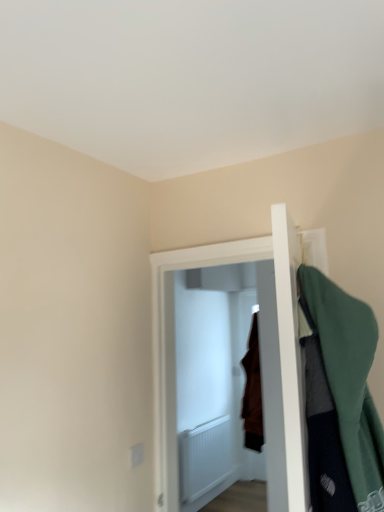
What do you see at coordinates (262, 356) in the screenshot? Image resolution: width=384 pixels, height=512 pixels. I see `white wooden door at center` at bounding box center [262, 356].

At what (x,y) coordinates should I click in order to perform the action: click on white wooden door at center. Please return your answer as a coordinate pair (x, y). Looking at the image, I should click on click(x=262, y=356).

This screenshot has height=512, width=384. What do you see at coordinates (340, 397) in the screenshot?
I see `green fabric coat at right` at bounding box center [340, 397].

Locate an element on the screen. This screenshot has width=384, height=512. green fabric coat at right is located at coordinates [340, 397].

Locate an element on the screen. This screenshot has width=384, height=512. white wooden door at center is located at coordinates (262, 356).

Based on the photo, does green fabric coat at right appear on the right side of white wooden door at center?

Yes.

Is green fabric coat at right positioned behind white wooden door at center?

No, it is in front of white wooden door at center.

Is point (362, 426) closer or farther from the camera than point (155, 405)?

Point (362, 426) is closer to the camera than point (155, 405).

From the image's perspective, between green fabric coat at right and white wooden door at center, who is located below?

white wooden door at center, from the image's perspective.

From a real-world perspective, is green fabric coat at right over white wooden door at center?

Yes, from a real-world perspective, green fabric coat at right is above white wooden door at center.

In the scene shown: Does green fabric coat at right have a greater width compared to white wooden door at center?

In fact, green fabric coat at right might be narrower than white wooden door at center.

From their relative heights in the image, would you say green fabric coat at right is taller or shorter than white wooden door at center?

green fabric coat at right is shorter than white wooden door at center.

Can you confirm if green fabric coat at right is bigger than white wooden door at center?

Result: Incorrect, green fabric coat at right is not larger than white wooden door at center.

Is green fabric coat at right not within white wooden door at center?

Yes.

Consider the image. Is there a large distance between green fabric coat at right and white wooden door at center?

No, green fabric coat at right is not far away from white wooden door at center.

Is green fabric coat at right facing towards white wooden door at center?

No, green fabric coat at right is not facing towards white wooden door at center.

Can you tell me how much green fabric coat at right and white wooden door at center differ in facing direction?

There is a 79-degree angle between the facing directions of green fabric coat at right and white wooden door at center.

How much distance is there between green fabric coat at right and white wooden door at center?

They are 27.87 inches apart.

Image resolution: width=384 pixels, height=512 pixels. What are the coordinates of `door that is under the green fabric coat at right (from a real-world perspective)` in the screenshot? It's located at (262, 356).

Between white wooden door at center and green fabric coat at right, which one appears on the right side from the viewer's perspective?

From the viewer's perspective, green fabric coat at right appears more on the right side.

Does white wooden door at center lie in front of green fabric coat at right?

No, white wooden door at center is further to the viewer.

Which point is more forward, (270, 279) or (329, 291)?

The point (329, 291) is in front.

From the image's perspective, is white wooden door at center located above green fabric coat at right?

No, from the image's perspective, white wooden door at center is not over green fabric coat at right.

From the picture: From a real-world perspective, relative to green fabric coat at right, is white wooden door at center vertically above or below?

white wooden door at center is below green fabric coat at right.

Can you confirm if white wooden door at center is wider than green fabric coat at right?

Indeed, white wooden door at center has a greater width compared to green fabric coat at right.

Considering the sizes of white wooden door at center and green fabric coat at right in the image, is white wooden door at center taller or shorter than green fabric coat at right?

Considering their sizes, white wooden door at center has more height than green fabric coat at right.

Does white wooden door at center have a smaller size compared to green fabric coat at right?

No.

Consider the image. Is white wooden door at center located outside green fabric coat at right?

That's correct, white wooden door at center is outside of green fabric coat at right.

Are white wooden door at center and green fabric coat at right located far from each other?

No, white wooden door at center is in close proximity to green fabric coat at right.

Is white wooden door at center aimed at green fabric coat at right?

No, white wooden door at center does not turn towards green fabric coat at right.

Can you tell me how much white wooden door at center and green fabric coat at right differ in facing direction?

There is a 79-degree angle between the facing directions of white wooden door at center and green fabric coat at right.

How distant is white wooden door at center from green fabric coat at right?

27.87 inches.

Where is `door located underneath the green fabric coat at right (from a real-world perspective)`? door located underneath the green fabric coat at right (from a real-world perspective) is located at coordinates (262, 356).

Locate an element on the screen. door to the left of green fabric coat at right is located at coordinates (262, 356).

In order to click on door that is below the green fabric coat at right (from the image's perspective) in this screenshot , I will do `click(262, 356)`.